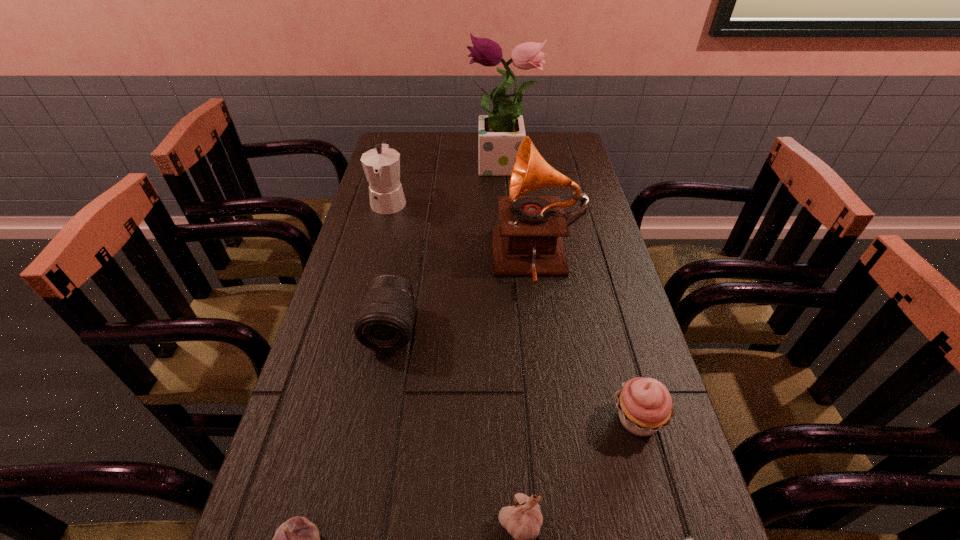
The width and height of the screenshot is (960, 540). What are the coordinates of `free point located on the horn of the sixth nearest object` in the screenshot? It's located at (401, 261).

The width and height of the screenshot is (960, 540). What are the coordinates of `vacant space situated on the horn of the sixth nearest object` in the screenshot? It's located at (431, 261).

Image resolution: width=960 pixels, height=540 pixels. What are the coordinates of `free space located 0.270m at the spout of the sixth shortest object` in the screenshot? It's located at (369, 281).

Find the location of `vacant space located on the surface of the telephoto lens`. vacant space located on the surface of the telephoto lens is located at coordinates (364, 474).

The image size is (960, 540). I want to click on free space located 0.250m on the left of the fifth farthest object, so click(483, 419).

The width and height of the screenshot is (960, 540). What are the coordinates of `object at the far edge` in the screenshot? It's located at (501, 132).

This screenshot has height=540, width=960. I want to click on coffeepot positioned at the left edge, so click(381, 165).

Find the location of a particular element. This screenshot has width=960, height=540. telephoto lens present at the left edge is located at coordinates [x=384, y=323].

Find the location of a particular element. phonograph record present at the right edge is located at coordinates (528, 240).

Image resolution: width=960 pixels, height=540 pixels. I want to click on cupcake that is at the right edge, so click(x=645, y=406).